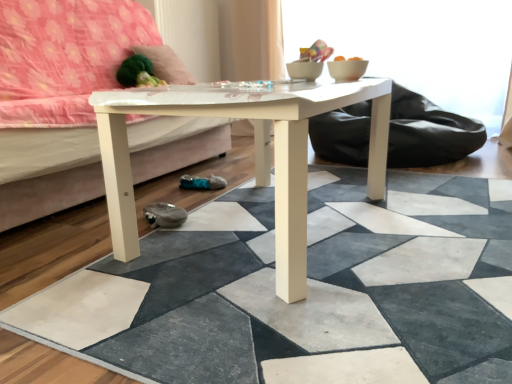
Question: Can white glossy studio couch at center be found inside white glossy coffee table at center?

Choices:
 (A) yes
 (B) no

Answer: (B)

Question: From a real-world perspective, is white glossy coffee table at center located beneath white glossy studio couch at center?

Choices:
 (A) yes
 (B) no

Answer: (A)

Question: Is white glossy coffee table at center oriented towards white glossy studio couch at center?

Choices:
 (A) yes
 (B) no

Answer: (B)

Question: From the image's perspective, is white glossy coffee table at center under white glossy studio couch at center?

Choices:
 (A) yes
 (B) no

Answer: (A)

Question: Considering the relative sizes of white glossy coffee table at center and white glossy studio couch at center in the image provided, is white glossy coffee table at center wider than white glossy studio couch at center?

Choices:
 (A) yes
 (B) no

Answer: (A)

Question: Is white glossy coffee table at center oriented away from white glossy studio couch at center?

Choices:
 (A) yes
 (B) no

Answer: (B)

Question: From a real-world perspective, is velvety green pillow at upper left on top of white glossy coffee table at center?

Choices:
 (A) yes
 (B) no

Answer: (A)

Question: From the image's perspective, would you say velvety green pillow at upper left is shown under white glossy coffee table at center?

Choices:
 (A) no
 (B) yes

Answer: (A)

Question: Is white glossy coffee table at center at the back of velvety green pillow at upper left?

Choices:
 (A) no
 (B) yes

Answer: (A)

Question: Can you confirm if velvety green pillow at upper left is shorter than white glossy coffee table at center?

Choices:
 (A) no
 (B) yes

Answer: (B)

Question: Is velvety green pillow at upper left smaller than white glossy coffee table at center?

Choices:
 (A) no
 (B) yes

Answer: (B)

Question: Does velvety green pillow at upper left appear on the left side of white glossy coffee table at center?

Choices:
 (A) yes
 (B) no

Answer: (A)

Question: Can you confirm if white glossy coffee table at center is bigger than velvety green pillow at upper left?

Choices:
 (A) yes
 (B) no

Answer: (A)